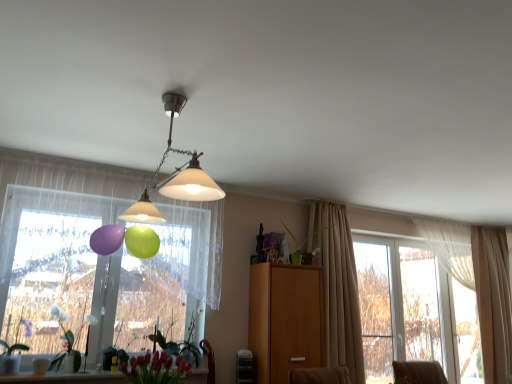
Question: From the image's perspective, is translucent glass vase at lower center, which appears as the 1th window when ordered from the bottom, on green matte plant at center, acting as the first plant starting from the right?

Choices:
 (A) yes
 (B) no

Answer: (B)

Question: Would you say translucent glass vase at lower center, which appears as the 1th window when ordered from the bottom, is outside green matte plant at center, acting as the first plant starting from the right?

Choices:
 (A) no
 (B) yes

Answer: (B)

Question: Can green matte plant at center, acting as the first plant starting from the right, be found inside translucent glass vase at lower center, which appears as the 1th window when ordered from the bottom?

Choices:
 (A) yes
 (B) no

Answer: (B)

Question: Does translucent glass vase at lower center, which appears as the 1th window when ordered from the bottom, have a lesser width compared to green matte plant at center, the 4th plant positioned from the left?

Choices:
 (A) no
 (B) yes

Answer: (A)

Question: Can you confirm if translucent glass vase at lower center, which ranks as the 2th window in top-to-bottom order, is smaller than green matte plant at center, the 4th plant positioned from the left?

Choices:
 (A) no
 (B) yes

Answer: (B)

Question: From a real-world perspective, is translucent glass vase at lower center, which ranks as the 2th window in top-to-bottom order, physically below green matte plant at center, the 4th plant positioned from the left?

Choices:
 (A) yes
 (B) no

Answer: (A)

Question: Considering the relative sizes of beige fabric curtain at right, which is the 1th curtain in front-to-back order, and smooth glossy tulip at lower center in the image provided, is beige fabric curtain at right, which is the 1th curtain in front-to-back order, shorter than smooth glossy tulip at lower center?

Choices:
 (A) yes
 (B) no

Answer: (B)

Question: Does beige fabric curtain at right, acting as the 2th curtain starting from the back, have a larger size compared to smooth glossy tulip at lower center?

Choices:
 (A) no
 (B) yes

Answer: (B)

Question: Does beige fabric curtain at right, which is the 1th curtain in front-to-back order, have a lesser width compared to smooth glossy tulip at lower center?

Choices:
 (A) yes
 (B) no

Answer: (A)

Question: Is the position of beige fabric curtain at right, which is counted as the 1th curtain, starting from the left, less distant than that of smooth glossy tulip at lower center?

Choices:
 (A) yes
 (B) no

Answer: (B)

Question: Is beige fabric curtain at right, which is counted as the 1th curtain, starting from the left, facing towards smooth glossy tulip at lower center?

Choices:
 (A) no
 (B) yes

Answer: (A)

Question: Would you consider beige fabric curtain at right, which is the 1th curtain in front-to-back order, to be distant from smooth glossy tulip at lower center?

Choices:
 (A) yes
 (B) no

Answer: (A)

Question: From the image's perspective, is matte white lampshade at center located above green matte plant at lower left, acting as the first plant starting from the left?

Choices:
 (A) no
 (B) yes

Answer: (B)